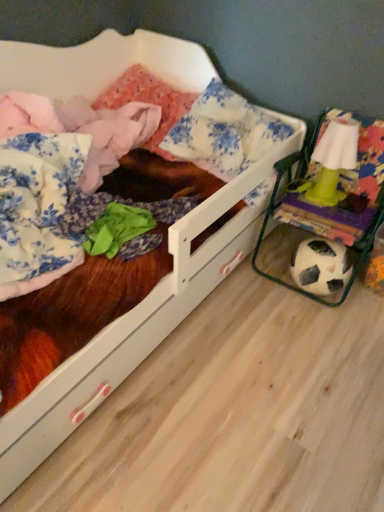
This screenshot has width=384, height=512. What do you see at coordinates (138, 322) in the screenshot?
I see `white wooden bed at center` at bounding box center [138, 322].

Measure the distance between white wooden bed at center and camera.

35.98 inches.

Where is `white wooden bed at center`? Image resolution: width=384 pixels, height=512 pixels. white wooden bed at center is located at coordinates pos(138,322).

Locate an element on the screen. green plastic lamp at right is located at coordinates (332, 162).

Describe the element at coordinates (332, 162) in the screenshot. I see `green plastic lamp at right` at that location.

Where is `white wooden bed at center`? white wooden bed at center is located at coordinates (138, 322).

Between green plastic lamp at right and white wooden bed at center, which one appears on the right side from the viewer's perspective?

green plastic lamp at right.

In the image, is green plastic lamp at right positioned in front of or behind white wooden bed at center?

Clearly, green plastic lamp at right is behind white wooden bed at center.

Which is closer to the camera, (325, 179) or (129, 64)?

Point (325, 179).

From the image's perspective, is green plastic lamp at right over white wooden bed at center?

Yes, from the image's perspective, green plastic lamp at right is above white wooden bed at center.

From a real-world perspective, who is located higher, green plastic lamp at right or white wooden bed at center?

green plastic lamp at right, from a real-world perspective.

Based on the photo, looking at their sizes, would you say green plastic lamp at right is wider or thinner than white wooden bed at center?

green plastic lamp at right is thinner than white wooden bed at center.

Does green plastic lamp at right have a greater height compared to white wooden bed at center?

No, green plastic lamp at right is not taller than white wooden bed at center.

Does green plastic lamp at right have a larger size compared to white wooden bed at center?

Actually, green plastic lamp at right might be smaller than white wooden bed at center.

Would you say green plastic lamp at right contains white wooden bed at center?

That's incorrect, white wooden bed at center is not inside green plastic lamp at right.

Are green plastic lamp at right and white wooden bed at center making contact?

green plastic lamp at right and white wooden bed at center are not in contact.

Is green plastic lamp at right positioned with its back to white wooden bed at center?

No, white wooden bed at center is not at the back of green plastic lamp at right.

Locate an element on the screen. toy located above the white wooden bed at center (from a real-world perspective) is located at coordinates (332, 162).

Considering the positions of objects white wooden bed at center and green plastic lamp at right in the image provided, who is more to the right, white wooden bed at center or green plastic lamp at right?

From the viewer's perspective, green plastic lamp at right appears more on the right side.

Relative to green plastic lamp at right, is white wooden bed at center in front or behind?

In the image, white wooden bed at center appears in front of green plastic lamp at right.

Between point (229, 272) and point (344, 168), which one is positioned in front?

Positioned in front is point (344, 168).

From the image's perspective, is white wooden bed at center located above green plastic lamp at right?

No, from the image's perspective, white wooden bed at center is not on top of green plastic lamp at right.

From a real-world perspective, relative to green plastic lamp at right, is white wooden bed at center vertically above or below?

white wooden bed at center is below green plastic lamp at right.

Can you confirm if white wooden bed at center is thinner than green plastic lamp at right?

In fact, white wooden bed at center might be wider than green plastic lamp at right.

Considering the sizes of objects white wooden bed at center and green plastic lamp at right in the image provided, who is shorter, white wooden bed at center or green plastic lamp at right?

green plastic lamp at right.

Considering the relative sizes of white wooden bed at center and green plastic lamp at right in the image provided, is white wooden bed at center smaller than green plastic lamp at right?

Incorrect, white wooden bed at center is not smaller in size than green plastic lamp at right.

Is green plastic lamp at right surrounded by white wooden bed at center?

That's incorrect, green plastic lamp at right is not inside white wooden bed at center.

Is the surface of white wooden bed at center in direct contact with green plastic lamp at right?

They are not placed beside each other.

Is white wooden bed at center looking in the opposite direction of green plastic lamp at right?

No, white wooden bed at center's orientation is not away from green plastic lamp at right.

What are the coordinates of `toy that appears above the white wooden bed at center (from the image's perspective)` in the screenshot? It's located at (332, 162).

This screenshot has width=384, height=512. Find the location of `infant bed that appears below the green plastic lamp at right (from a real-world perspective)`. infant bed that appears below the green plastic lamp at right (from a real-world perspective) is located at coordinates (138, 322).

I want to click on infant bed in front of the green plastic lamp at right, so click(138, 322).